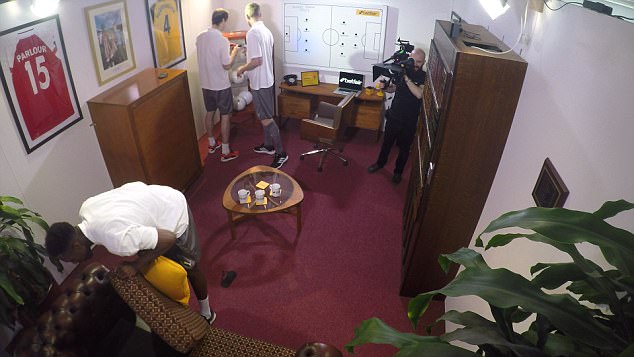
At what (x,y) coordinates should I click in order to perform the action: click on table. Please return your answer as a coordinate pair (x, y). Looking at the image, I should click on (288, 194).